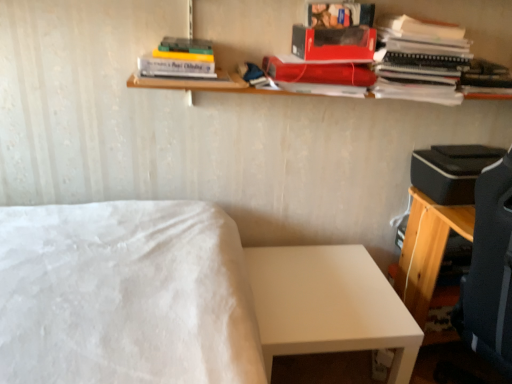
Where is `vacant point above matte red paperback book at upper center, which is counted as the third paperback book, starting from the bottom (from a real-world perspective)`? vacant point above matte red paperback book at upper center, which is counted as the third paperback book, starting from the bottom (from a real-world perspective) is located at coordinates (333, 27).